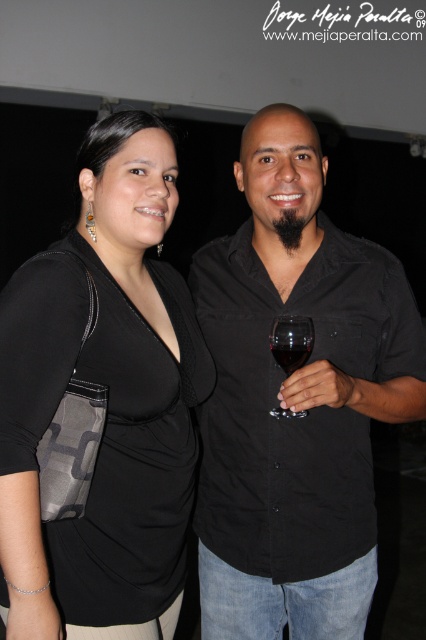
Question: Which of the following is the farthest from the observer?

Choices:
 (A) (293, 140)
 (B) (282, 349)
 (C) (135, 285)
 (D) (302, 353)

Answer: (A)

Question: Does black matte shirt at center come behind translucent glass at center?

Choices:
 (A) yes
 (B) no

Answer: (B)

Question: Which is farther from the translucent glass at center?

Choices:
 (A) black matte shirt at center
 (B) transparent glass at right
 (C) black matte/black textured bag at left

Answer: (C)

Question: From the image, what is the correct spatial relationship of black matte/black textured bag at left in relation to transparent glass at right?

Choices:
 (A) above
 (B) below

Answer: (B)

Question: Is black matte/black textured bag at left smaller than transparent glass at right?

Choices:
 (A) no
 (B) yes

Answer: (A)

Question: Which point is closer to the camera?

Choices:
 (A) (155, 164)
 (B) (298, 358)
 (C) (270, 275)
 (D) (296, 326)

Answer: (B)